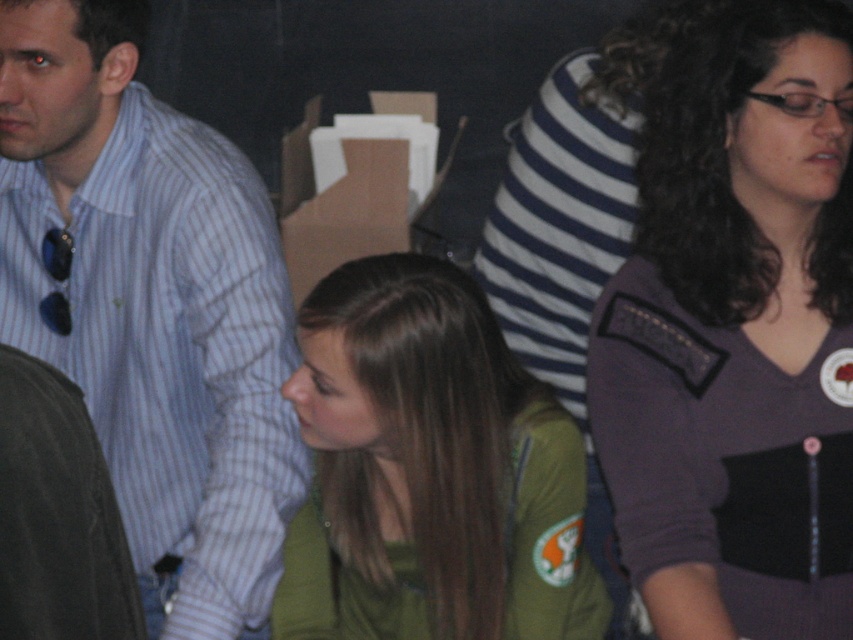
Based on the photo, you are organizing a small event and need to decide whether the green matte jacket at center can be placed inside the cardboard box at center. Based on their sizes, can the jacket fit inside the box?

The green matte jacket at center has a smaller size compared to cardboard box at center, so the jacket can fit inside the box.

Looking at this image, you are a delivery person who needs to place a small package between the purple fabric shirt at center and the cardboard box at center. Can you fit the package in the space between them if the package is 4 feet long?

The distance between the purple fabric shirt at center and the cardboard box at center is 4.29 feet. Since the package is 4 feet long, it can fit in the space between them as the available space is slightly larger than the package.